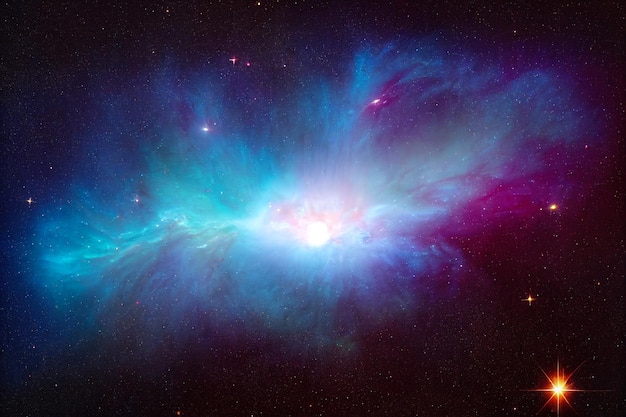
Locate an element on the screen. bright light is located at coordinates (322, 233), (310, 230).